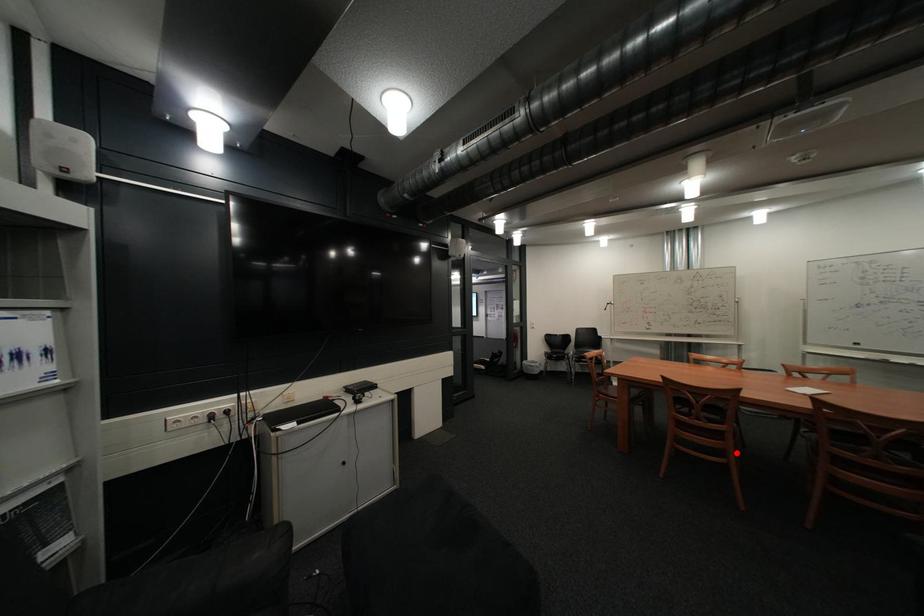
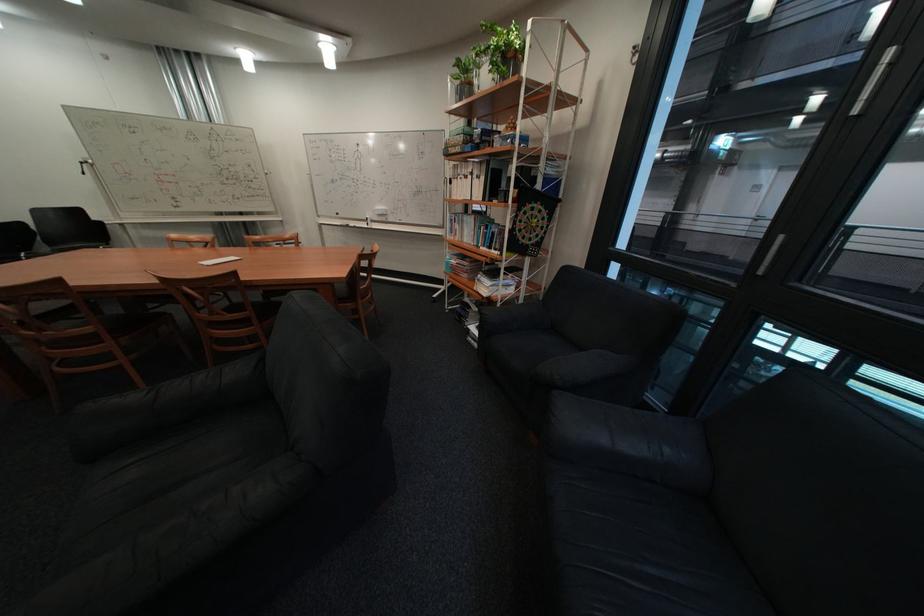
In the second image, find the point that corresponds to the highlighted location in the first image.

(119, 358)